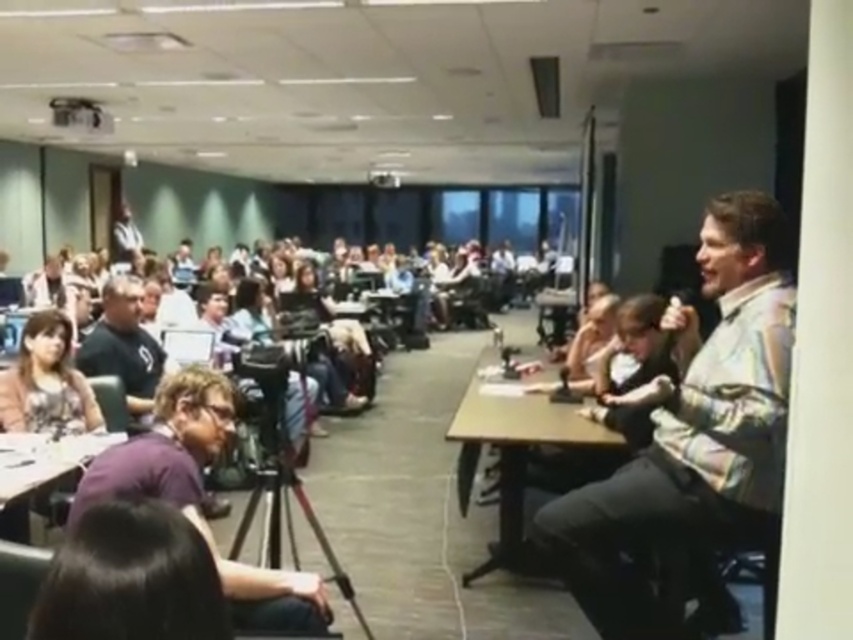
Question: Which of the following is the closest to the observer?

Choices:
 (A) (169, 484)
 (B) (579, 538)
 (C) (28, 528)

Answer: (A)

Question: Can you confirm if brown wooden table at center is wider than wooden table at lower left?

Choices:
 (A) no
 (B) yes

Answer: (B)

Question: Which object is the closest to the purple fabric shirt at lower left?

Choices:
 (A) wooden table at lower left
 (B) brown wooden table at center
 (C) camouflage shirt at right

Answer: (A)

Question: Which object is the closest to the purple fabric shirt at lower left?

Choices:
 (A) wooden table at lower left
 (B) camouflage shirt at right
 (C) brown wooden table at center

Answer: (A)

Question: Can you confirm if purple fabric shirt at lower left is positioned to the right of wooden table at lower left?

Choices:
 (A) yes
 (B) no

Answer: (A)

Question: Can you confirm if purple fabric shirt at lower left is positioned to the left of brown wooden table at center?

Choices:
 (A) no
 (B) yes

Answer: (B)